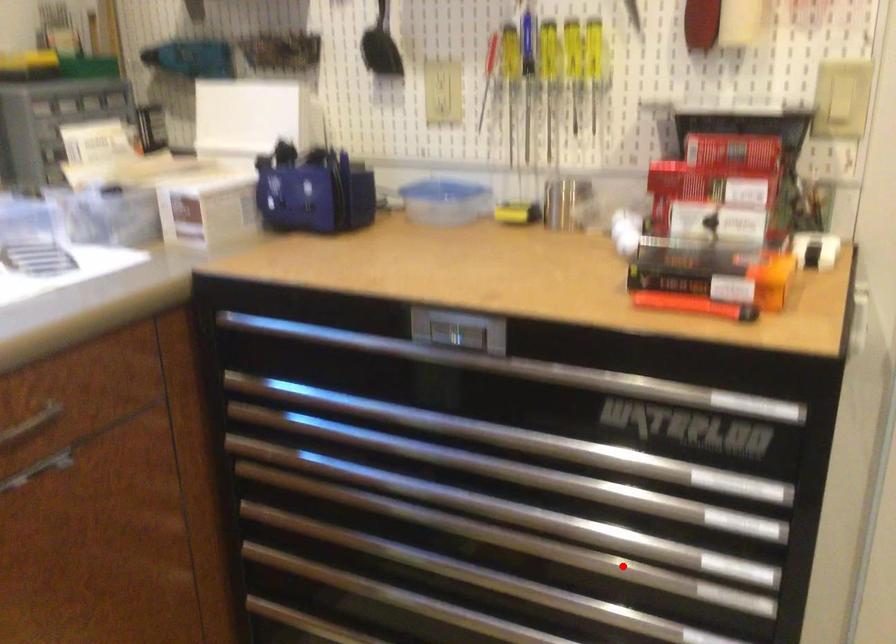
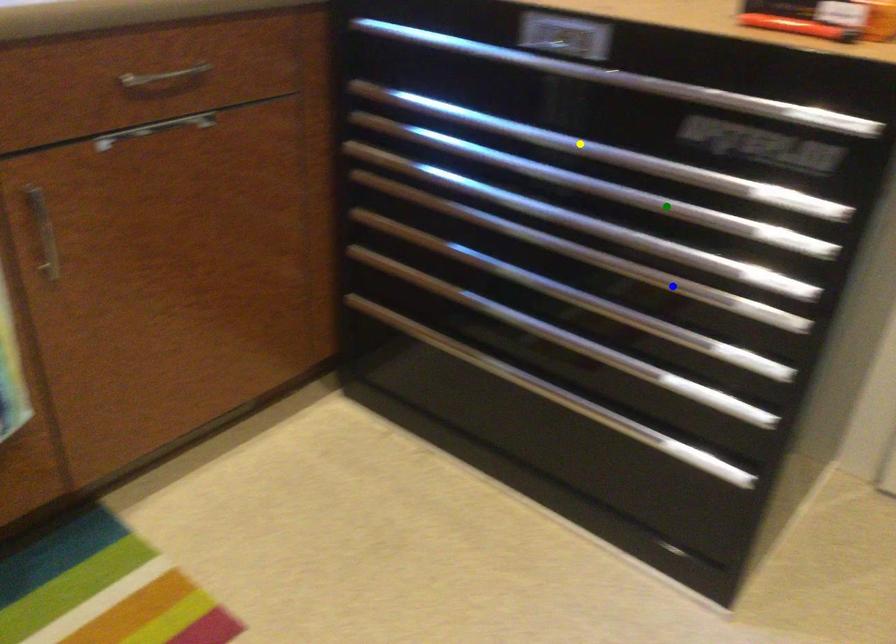
Question: I am providing you with two images of the same scene from different viewpoints. A red point is marked on the first image. You are given multiple points on the second image. Which spot in image 2 lines up with the point in image 1?

Choices:
 (A) green point
 (B) blue point
 (C) yellow point

Answer: (B)